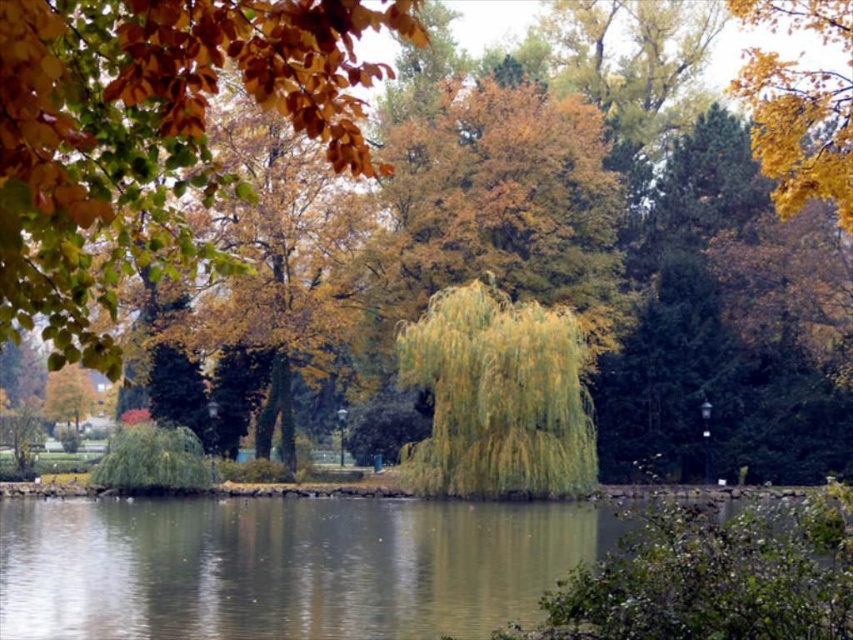
Question: Is yellow-green leaves at upper left wider than yellow/golden leaves at upper right?

Choices:
 (A) yes
 (B) no

Answer: (B)

Question: Is yellow-green leaves at upper left positioned in front of yellow/golden leaves at upper right?

Choices:
 (A) yes
 (B) no

Answer: (A)

Question: In this image, where is greenish reflective water at center located relative to yellow/golden leaves at upper right?

Choices:
 (A) above
 (B) below

Answer: (B)

Question: Which of the following is the closest to the observer?

Choices:
 (A) greenish reflective water at center
 (B) yellow-green leaves at upper left
 (C) yellow/golden leaves at upper right

Answer: (B)

Question: Estimate the real-world distances between objects in this image. Which object is closer to the yellow/golden leaves at upper right?

Choices:
 (A) greenish reflective water at center
 (B) yellow-green leaves at upper left

Answer: (B)

Question: Which of these objects is positioned closest to the greenish reflective water at center?

Choices:
 (A) yellow/golden leaves at upper right
 (B) yellow-green leaves at upper left

Answer: (B)